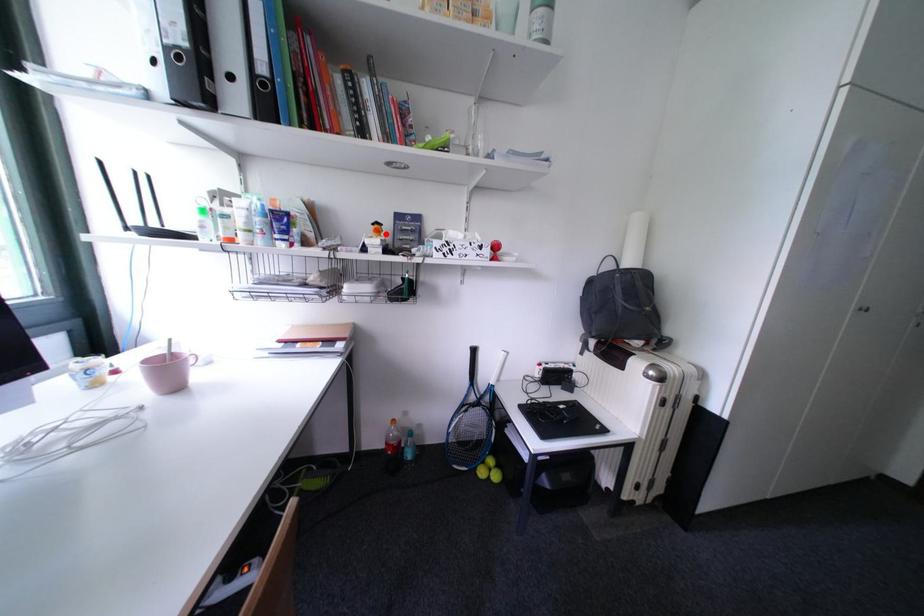
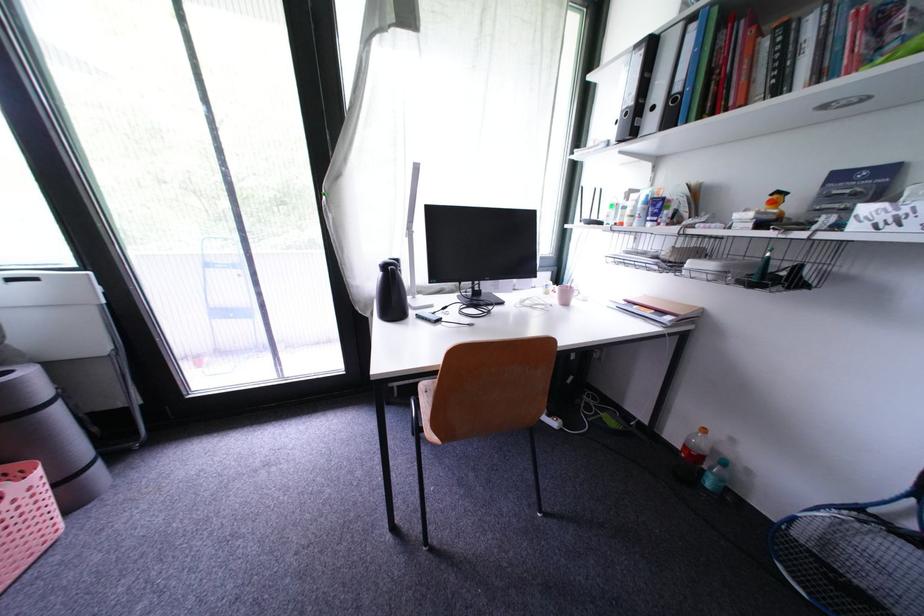
Where in the second image is the point corresponding to the highlighted location from the first image?

(782, 206)